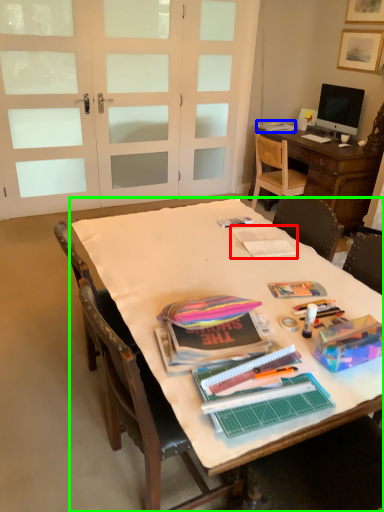
Question: Based on their relative distances, which object is farther from magazine (highlighted by a red box)? Choose from magazine (highlighted by a blue box) and table (highlighted by a green box).

Choices:
 (A) magazine
 (B) table

Answer: (A)